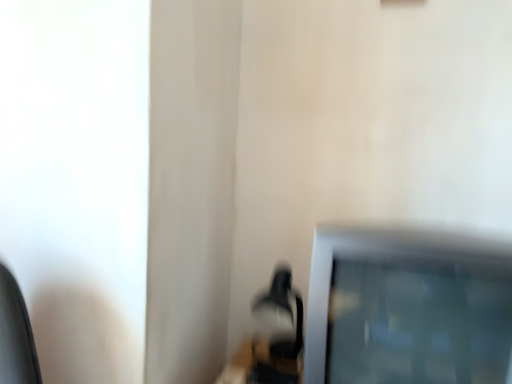
This screenshot has height=384, width=512. Describe the element at coordinates (279, 322) in the screenshot. I see `matte black table lamp at lower center` at that location.

Image resolution: width=512 pixels, height=384 pixels. I want to click on matte black table lamp at lower center, so tap(279, 322).

The height and width of the screenshot is (384, 512). Describe the element at coordinates (408, 308) in the screenshot. I see `satin silver television at lower right` at that location.

Locate an element on the screen. satin silver television at lower right is located at coordinates (408, 308).

Where is `matte black table lamp at lower center`? matte black table lamp at lower center is located at coordinates (279, 322).

Considering the relative positions of matte black table lamp at lower center and satin silver television at lower right in the image provided, is matte black table lamp at lower center to the left of satin silver television at lower right from the viewer's perspective?

Indeed, matte black table lamp at lower center is positioned on the left side of satin silver television at lower right.

Is matte black table lamp at lower center positioned behind satin silver television at lower right?

Yes, matte black table lamp at lower center is further from the viewer.

Is point (301, 328) closer or farther from the camera than point (330, 346)?

Point (301, 328) is positioned farther from the camera compared to point (330, 346).

From the image's perspective, does matte black table lamp at lower center appear lower than satin silver television at lower right?

Correct, matte black table lamp at lower center appears lower than satin silver television at lower right in the image.

From a real-world perspective, relative to satin silver television at lower right, is matte black table lamp at lower center vertically above or below?

From a real-world perspective, matte black table lamp at lower center is physically below satin silver television at lower right.

Which object is thinner, matte black table lamp at lower center or satin silver television at lower right?

Thinner between the two is matte black table lamp at lower center.

From the picture: Can you confirm if matte black table lamp at lower center is shorter than satin silver television at lower right?

Yes, matte black table lamp at lower center is shorter than satin silver television at lower right.

Considering the relative sizes of matte black table lamp at lower center and satin silver television at lower right in the image provided, is matte black table lamp at lower center smaller than satin silver television at lower right?

Correct, matte black table lamp at lower center occupies less space than satin silver television at lower right.

Is matte black table lamp at lower center not within satin silver television at lower right?

Indeed, matte black table lamp at lower center is completely outside satin silver television at lower right.

Is matte black table lamp at lower center far away from satin silver television at lower right?

No.

Could you tell me if matte black table lamp at lower center is turned towards satin silver television at lower right?

No, matte black table lamp at lower center is not oriented towards satin silver television at lower right.

What's the angular difference between matte black table lamp at lower center and satin silver television at lower right's facing directions?

There is a 0.66-degree angle between the facing directions of matte black table lamp at lower center and satin silver television at lower right.

Could you measure the distance between matte black table lamp at lower center and satin silver television at lower right?

A distance of 46.65 centimeters exists between matte black table lamp at lower center and satin silver television at lower right.

The image size is (512, 384). In order to click on television positioned vertically above the matte black table lamp at lower center (from a real-world perspective) in this screenshot , I will do `click(408, 308)`.

Which object is positioned more to the right, satin silver television at lower right or matte black table lamp at lower center?

satin silver television at lower right is more to the right.

Does satin silver television at lower right lie in front of matte black table lamp at lower center?

Yes, it is.

Considering the points (398, 326) and (280, 367), which point is in front, point (398, 326) or point (280, 367)?

The point (398, 326) is closer to the camera.

From the image's perspective, is satin silver television at lower right on matte black table lamp at lower center?

Yes, from the image's perspective, satin silver television at lower right is over matte black table lamp at lower center.

From a real-world perspective, relative to matte black table lamp at lower center, is satin silver television at lower right vertically above or below?

satin silver television at lower right is above matte black table lamp at lower center.

Between satin silver television at lower right and matte black table lamp at lower center, which one has larger width?

With larger width is satin silver television at lower right.

Who is shorter, satin silver television at lower right or matte black table lamp at lower center?

With less height is matte black table lamp at lower center.

Between satin silver television at lower right and matte black table lamp at lower center, which one has larger size?

satin silver television at lower right.

Is satin silver television at lower right inside the boundaries of matte black table lamp at lower center, or outside?

satin silver television at lower right is located beyond the bounds of matte black table lamp at lower center.

Is satin silver television at lower right with matte black table lamp at lower center?

There is a gap between satin silver television at lower right and matte black table lamp at lower center.

Could you tell me if satin silver television at lower right is facing matte black table lamp at lower center?

No, satin silver television at lower right is not turned towards matte black table lamp at lower center.

How many degrees apart are the facing directions of satin silver television at lower right and matte black table lamp at lower center?

The facing directions of satin silver television at lower right and matte black table lamp at lower center are 0.66 degrees apart.

How much distance is there between satin silver television at lower right and matte black table lamp at lower center?

satin silver television at lower right and matte black table lamp at lower center are 46.65 centimeters apart.

Find the location of a particular element. This screenshot has height=384, width=512. table lamp below the satin silver television at lower right (from a real-world perspective) is located at coordinates (279, 322).

You are a GUI agent. You are given a task and a screenshot of the screen. Output one action in this format:
    pyautogui.click(x=<x>, y=<y>)
    Task: Click on the table lamp on the left of satin silver television at lower right
    
    Given the screenshot: What is the action you would take?
    pyautogui.click(x=279, y=322)

Where is `table lamp directly beneath the satin silver television at lower right (from a real-world perspective)`? This screenshot has width=512, height=384. table lamp directly beneath the satin silver television at lower right (from a real-world perspective) is located at coordinates (279, 322).